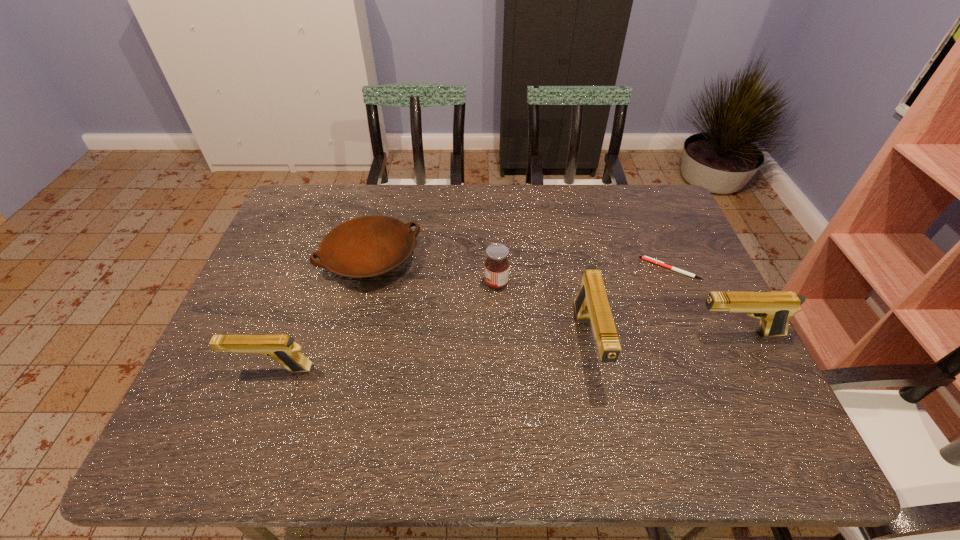
The height and width of the screenshot is (540, 960). In order to click on free space for an extra pistol to achieve even spacing in this screenshot , I will do tap(433, 357).